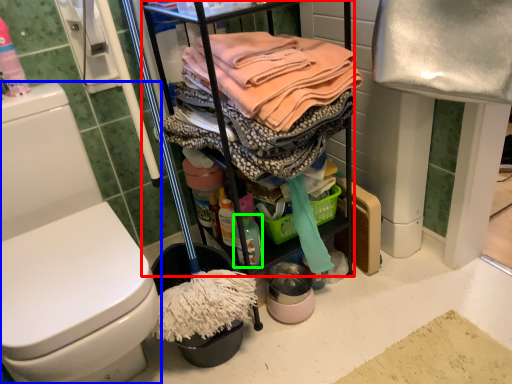
Question: Which object is the closest to the cabinetry (highlighted by a red box)? Choose among these: toilet (highlighted by a blue box) or cleaning products (highlighted by a green box).

Choices:
 (A) toilet
 (B) cleaning products

Answer: (B)